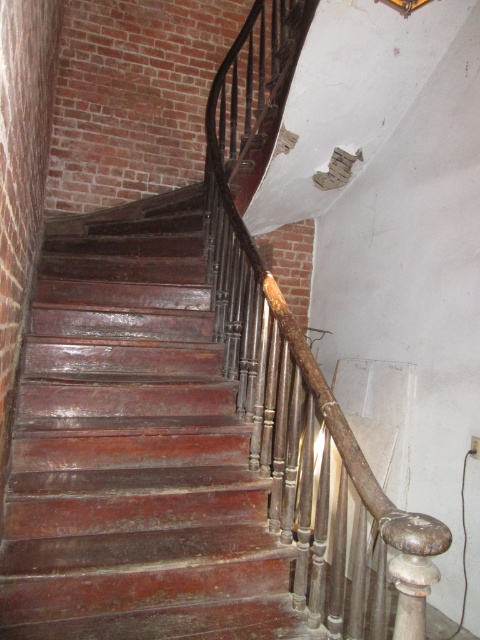
Which is more to the right, shiny wood stairs at center or rusty metal railing at center?

rusty metal railing at center is more to the right.

Which of these two, shiny wood stairs at center or rusty metal railing at center, stands shorter?

Standing shorter between the two is shiny wood stairs at center.

Is point (144, 272) farther from viewer compared to point (323, 529)?

Yes, it is behind point (323, 529).

This screenshot has width=480, height=640. I want to click on shiny wood stairs at center, so click(134, 449).